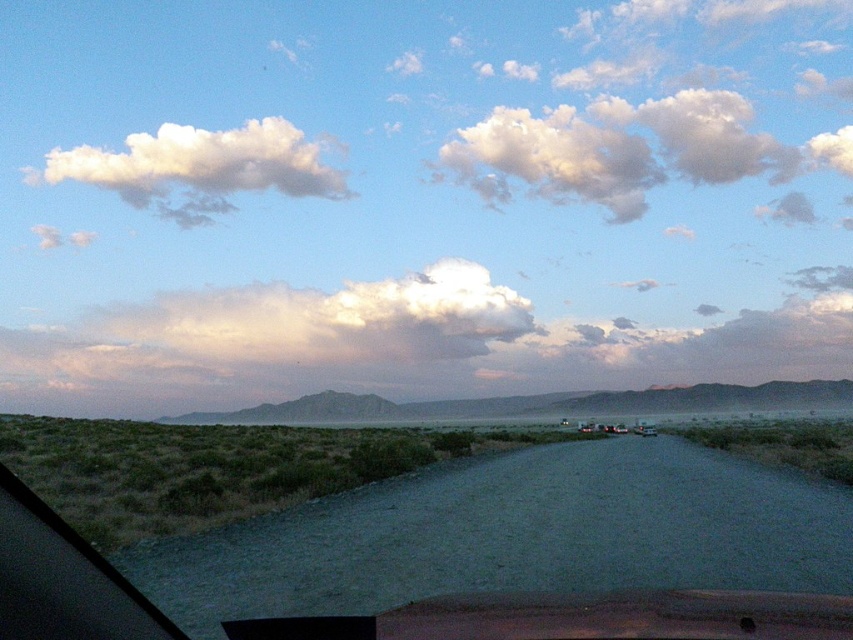
You are driving a car and looking out the transparent glass car window at lower left. You notice a white fluffy cloud at upper left in the sky. Is the cloud positioned to the left or right side of your view from the window?

The white fluffy cloud at upper left is to the left of the transparent glass car window at lower left, so from your viewpoint inside the car, the cloud would appear on the left side of your view through the window.